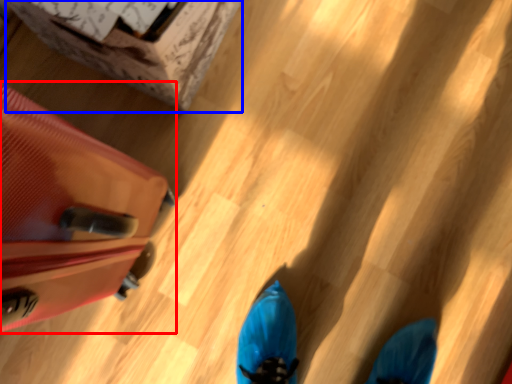
Question: Among these objects, which one is farthest to the camera, luggage (highlighted by a red box) or cardboard box (highlighted by a blue box)?

Choices:
 (A) luggage
 (B) cardboard box

Answer: (B)